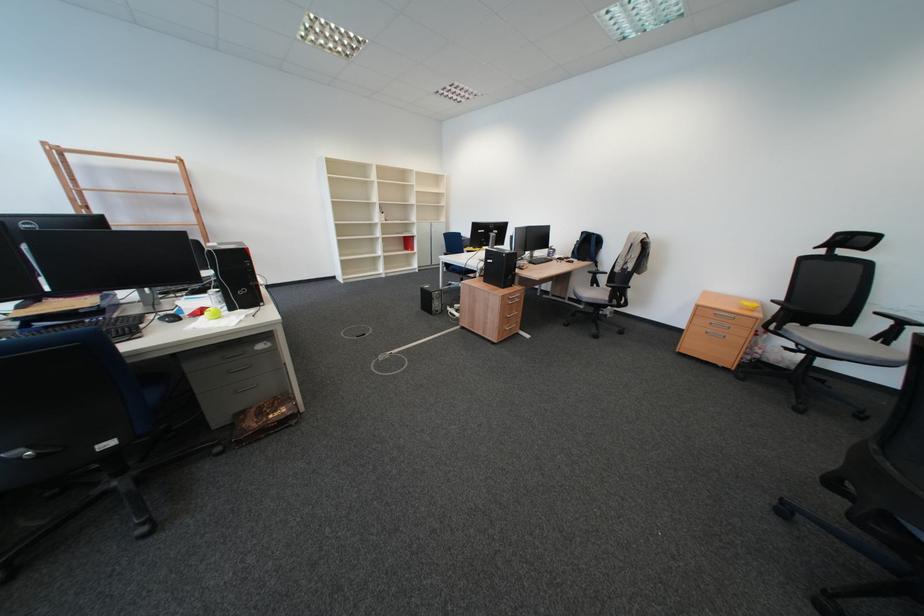
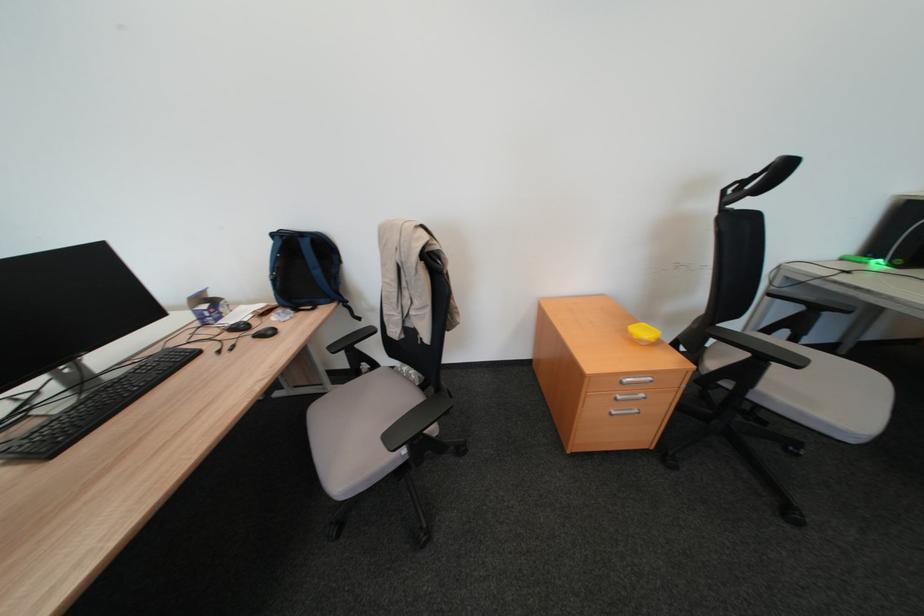
Find the pixel in the second image that matches (608,237) in the first image.

(320, 241)